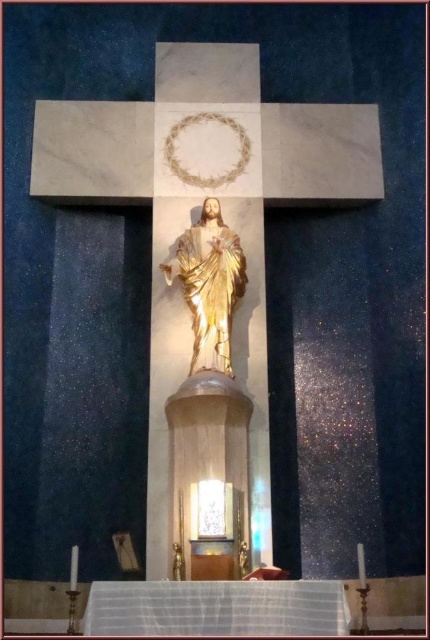
Looking at this image, can you confirm if gold leaf statue at center is bigger than gold polished statue at center?

Correct, gold leaf statue at center is larger in size than gold polished statue at center.

Consider the image. Is gold leaf statue at center wider than gold polished statue at center?

Correct, the width of gold leaf statue at center exceeds that of gold polished statue at center.

Where is `gold leaf statue at center`? gold leaf statue at center is located at coordinates click(x=208, y=284).